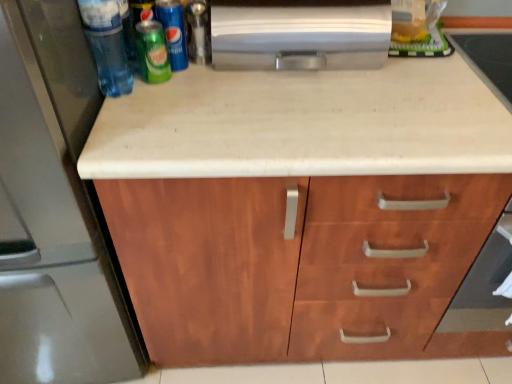
Question: Could you tell me if wooden cabinet at center is turned towards green matte pepsi can at upper left, the 2th beer in the left-to-right sequence?

Choices:
 (A) yes
 (B) no

Answer: (B)

Question: From a real-world perspective, is wooden cabinet at center beneath green matte pepsi can at upper left, the 2th beer in the left-to-right sequence?

Choices:
 (A) no
 (B) yes

Answer: (B)

Question: From a real-world perspective, does wooden cabinet at center stand above green matte pepsi can at upper left, acting as the 1th beer starting from the right?

Choices:
 (A) no
 (B) yes

Answer: (A)

Question: Is wooden cabinet at center at the right side of green matte pepsi can at upper left, the 2th beer in the left-to-right sequence?

Choices:
 (A) no
 (B) yes

Answer: (B)

Question: Considering the relative sizes of wooden cabinet at center and green matte pepsi can at upper left, acting as the 1th beer starting from the right, in the image provided, is wooden cabinet at center wider than green matte pepsi can at upper left, acting as the 1th beer starting from the right,?

Choices:
 (A) no
 (B) yes

Answer: (B)

Question: Is wooden cabinet at center positioned behind green matte pepsi can at upper left, the 2th beer in the left-to-right sequence?

Choices:
 (A) no
 (B) yes

Answer: (A)

Question: From the image's perspective, is satin metallic refrigerator at left located beneath green matte pepsi can at upper left, acting as the 1th beer starting from the right?

Choices:
 (A) yes
 (B) no

Answer: (A)

Question: Is satin metallic refrigerator at left to the left of green matte pepsi can at upper left, acting as the 1th beer starting from the right, from the viewer's perspective?

Choices:
 (A) yes
 (B) no

Answer: (A)

Question: Is satin metallic refrigerator at left not near green matte pepsi can at upper left, acting as the 1th beer starting from the right?

Choices:
 (A) no
 (B) yes

Answer: (A)

Question: Is green matte pepsi can at upper left, the 2th beer in the left-to-right sequence, a part of satin metallic refrigerator at left?

Choices:
 (A) yes
 (B) no

Answer: (B)

Question: Is satin metallic refrigerator at left bigger than green matte pepsi can at upper left, acting as the 1th beer starting from the right?

Choices:
 (A) yes
 (B) no

Answer: (A)

Question: From a real-world perspective, does satin metallic refrigerator at left stand above green matte pepsi can at upper left, acting as the 1th beer starting from the right?

Choices:
 (A) yes
 (B) no

Answer: (B)

Question: Can you confirm if green matte soda can at upper left, acting as the first beer starting from the left, is shorter than green matte pepsi can at upper left, acting as the 1th beer starting from the right?

Choices:
 (A) no
 (B) yes

Answer: (B)